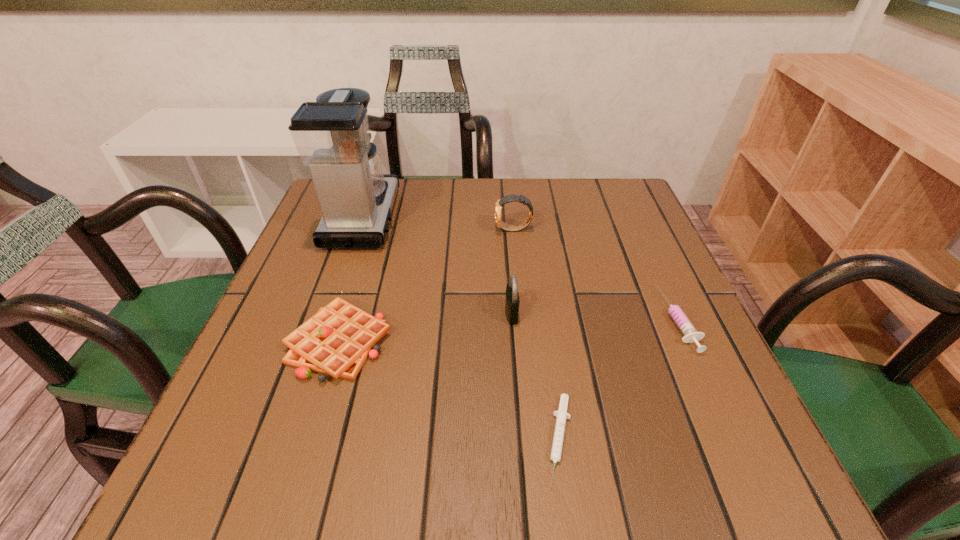
Where is `waffle at the left edge`? This screenshot has width=960, height=540. waffle at the left edge is located at coordinates (337, 340).

Identify the location of object present at the right edge. The width and height of the screenshot is (960, 540). (686, 327).

You are a GUI agent. You are given a task and a screenshot of the screen. Output one action in this format:
    pyautogui.click(x=<x>, y=<y>)
    Task: Click on the object that is at the far left corner
    This screenshot has width=960, height=540.
    Given the screenshot: What is the action you would take?
    pos(331,135)

In the image, there is a desktop. Where is `vacant space at the far edge`? This screenshot has height=540, width=960. vacant space at the far edge is located at coordinates (427, 225).

The width and height of the screenshot is (960, 540). What are the coordinates of `free space at the near edge of the desktop` in the screenshot? It's located at (464, 442).

The image size is (960, 540). What are the coordinates of `vacant space at the left edge of the desktop` in the screenshot? It's located at (296, 403).

You are a GUI agent. You are given a task and a screenshot of the screen. Output one action in this format:
    pyautogui.click(x=<x>, y=<y>)
    Task: Click on the vacant space at the right edge
    The height and width of the screenshot is (540, 960).
    Given the screenshot: What is the action you would take?
    pyautogui.click(x=642, y=325)

In order to click on free space at the far right corner of the desktop in this screenshot , I will do `click(633, 210)`.

Where is `free spot at the near right corner of the desktop`? This screenshot has width=960, height=540. free spot at the near right corner of the desktop is located at coordinates (665, 483).

Find the location of a particular element. This screenshot has height=540, width=960. free point between the third shortest object and the padlock is located at coordinates (425, 328).